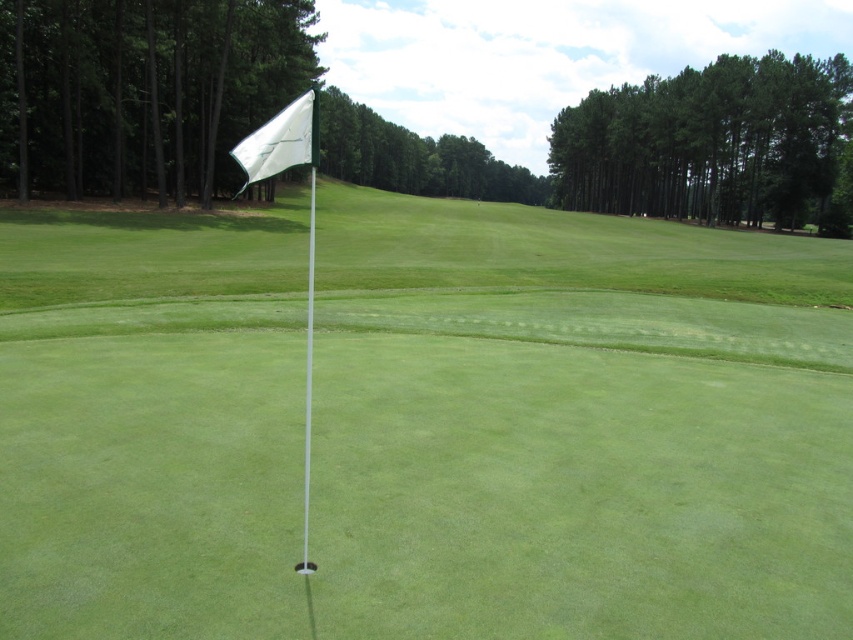
You are a golfer trying to hit the ball into the hole near the bottom center. You notice two flags at the center of the putting green. Which flag should you aim for, the white fabric flag at center or the white glossy flag at center?

You should aim for the white fabric flag at center because it is the smaller one and positioned directly over the hole, while the white glossy flag at center is larger and likely part of a decorative element or a nearby structure.

You are a golfer trying to hit the ball into the hole. The flag is at the center of the green. Where should you aim your shot relative to the white fabric flag at center?

You should aim directly at the white fabric flag at center since it marks the hole location on the green.

You are a golfer standing at point A at position (125, 394). You want to hit a ball to the hole located at the center of the putting green. The distance between your position and the hole is 8.93 meters. If your putter can hit the ball with a maximum distance of 8 meters, will you need to use a different club to reach the hole?

The distance between point A at position (125, 394) and the hole is 8.93 meters. Since your putter can only hit up to 8 meters, you will need to use a different club to cover the remaining distance.